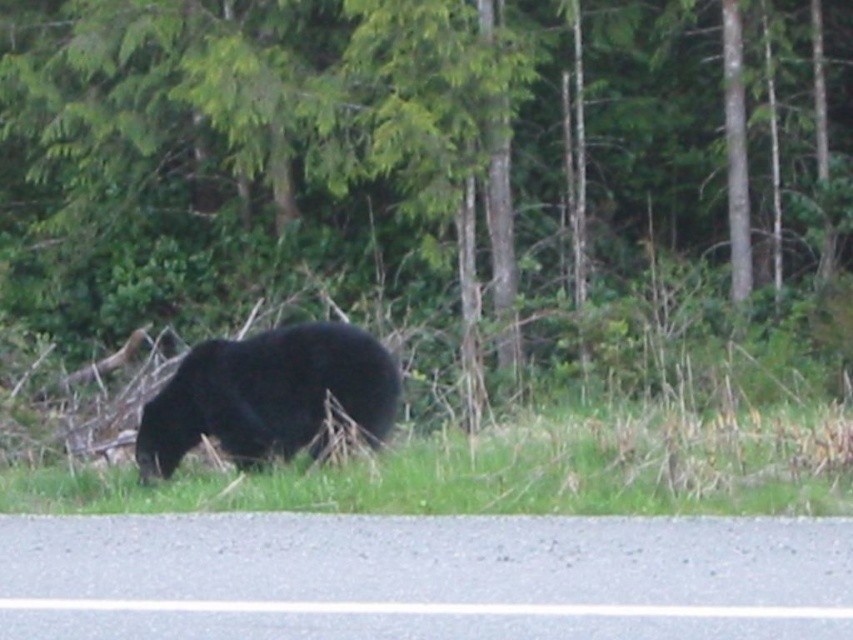
You are a hiker on the road and see the black furry bear at center and the green leafy tree at center. Which object is closer to you?

The green leafy tree at center is closer to you because the black furry bear at center is behind it.

You are a hiker standing on the road and see the green grass at lower center and the black furry bear at center. Which object is closer to your left side?

The black furry bear at center is closer to your left side because the green grass at lower center is to the right of it.

You are driving on the road and see the black furry bear at center and the green leafy tree at center. Which object is located to the right side of the other?

The green leafy tree at center is located to the right of the black furry bear at center.